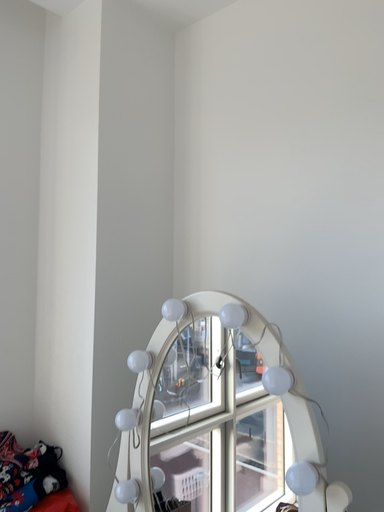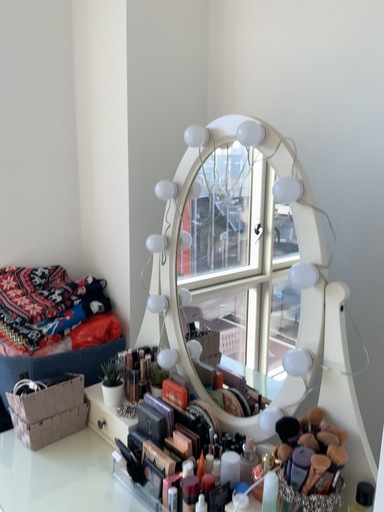
Question: Which way did the camera rotate in the video?

Choices:
 (A) rotated left
 (B) rotated right

Answer: (A)